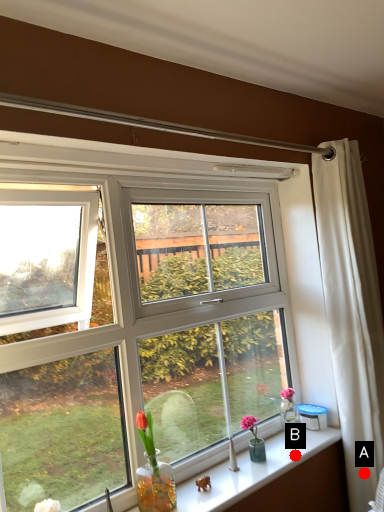
Question: Two points are circled on the image, labeled by A and B beside each circle. Among these points, which one is nearest to the camera?

Choices:
 (A) A is closer
 (B) B is closer

Answer: (B)